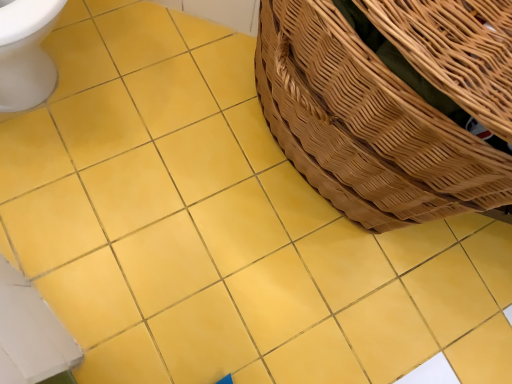
Locate an element on the screen. The height and width of the screenshot is (384, 512). vacant space positioned to the left of brown woven picnic basket at right is located at coordinates (154, 105).